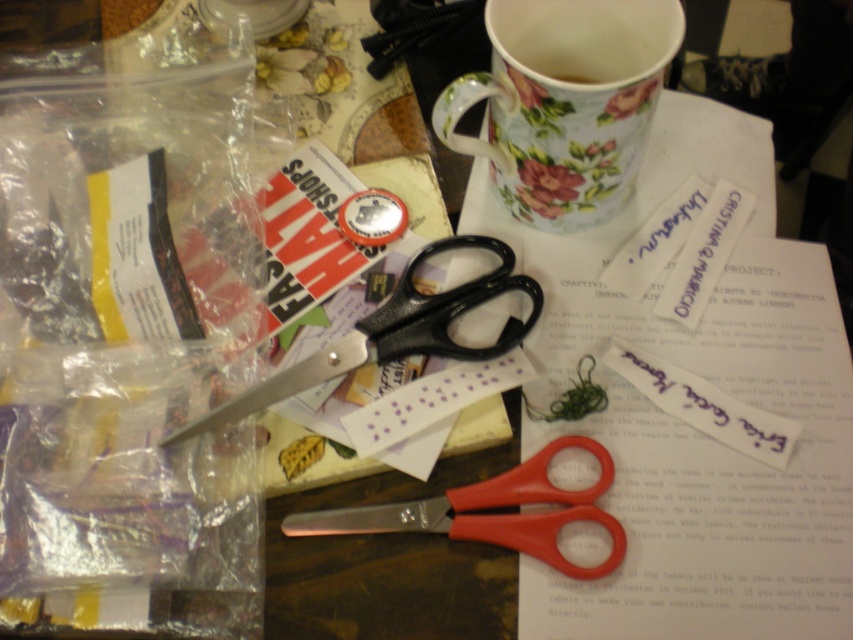
You are organizing the items on the table and need to place the black plastic scissors at center closer to the edge. Which direction should you move them to ensure they are near the floral ceramic mug at upper center?

You should move the black plastic scissors at center to the right to place them closer to the floral ceramic mug at upper center since the floral ceramic mug at upper center is located to the right of the black plastic scissors at center.

You are standing at the edge of the table looking towards the center. There are two points marked on the table surface. The first point is at coordinates point [642,42] and the second is at point [518,467]. If you want to reach both points by moving straight from your current position, which point will you encounter first?

You will encounter point [518,467] first because it is closer to your current position at the edge of the table compared to point [642,42], which is further away behind it.

You are a delivery robot with a 12 inch wide package. You need to place it on the table without moving any items. The only available space is at point (x=560, y=588). Can you fit the package there?

The point (x=560, y=588) is 19.20 inches away from the camera. Since the package is only 12 inches wide, it can fit at that location as there is enough space.